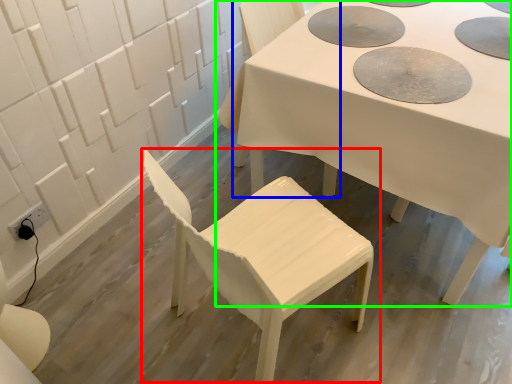
Question: Which is farther away from chair (highlighted by a red box)? chair (highlighted by a blue box) or table (highlighted by a green box)?

Choices:
 (A) chair
 (B) table

Answer: (A)